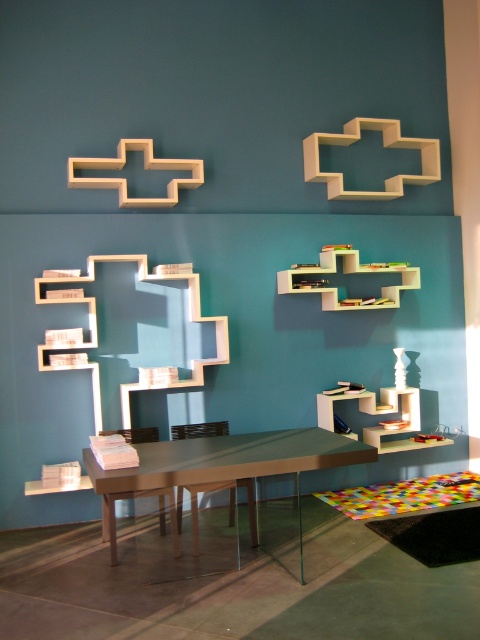
Between metallic glass table at center and white matte shelf at upper center, which one has more height?

white matte shelf at upper center

Is point (87, 452) closer to camera compared to point (410, 269)?

Yes, it is in front of point (410, 269).

This screenshot has height=640, width=480. I want to click on metallic glass table at center, so click(224, 461).